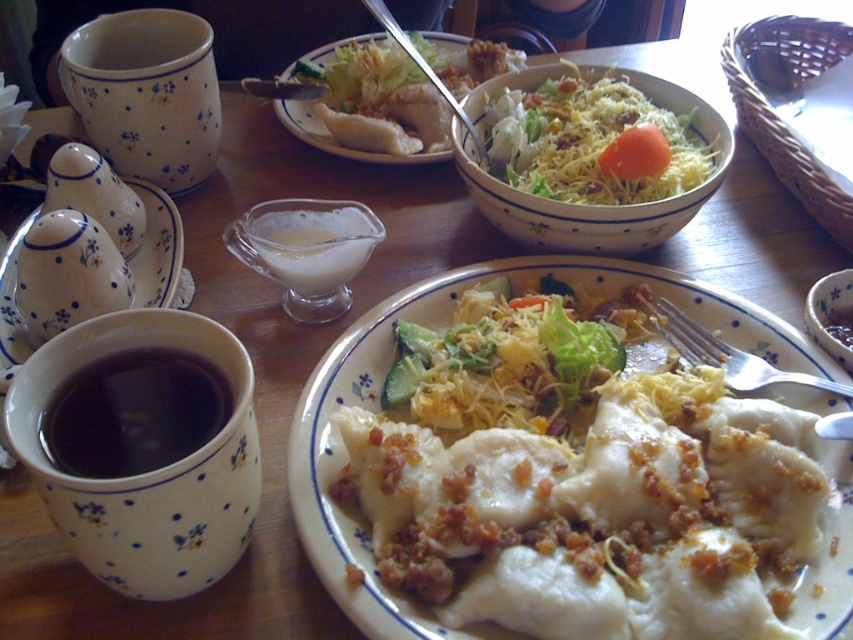
Question: Which point appears closest to the camera in this image?

Choices:
 (A) (250, 362)
 (B) (123, 365)
 (C) (302, 116)

Answer: (A)

Question: Considering the real-world distances, which object is farthest from the dark matte cup at left?

Choices:
 (A) white ceramic sugar bowl at left
 (B) matte ceramic bowl at center

Answer: (B)

Question: Can you confirm if white matte plate at center is positioned below orange smooth carrot at center?

Choices:
 (A) yes
 (B) no

Answer: (B)

Question: Can you confirm if white dumplings at center is smaller than white matte plate at center?

Choices:
 (A) no
 (B) yes

Answer: (A)

Question: Does dark matte cup at left come behind orange smooth carrot at center?

Choices:
 (A) no
 (B) yes

Answer: (A)

Question: Which object is the farthest from the matte ceramic bowl at center?

Choices:
 (A) white dumplings at center
 (B) white ceramic sugar bowl at left
 (C) white dotted bowl at center

Answer: (B)